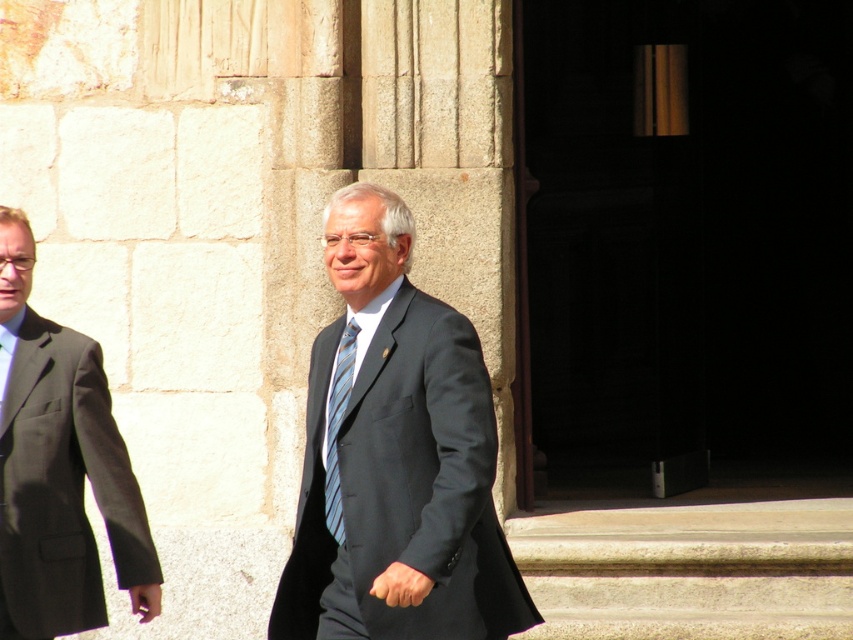
Question: Is the position of matte black suit at center less distant than that of matte black suit at left?

Choices:
 (A) no
 (B) yes

Answer: (B)

Question: Is matte black suit at left positioned behind striped fabric tie at center?

Choices:
 (A) yes
 (B) no

Answer: (A)

Question: Among these objects, which one is farthest from the camera?

Choices:
 (A) matte black suit at center
 (B) matte black suit at left
 (C) striped fabric tie at center

Answer: (B)

Question: Which of the following is the closest to the observer?

Choices:
 (A) striped fabric tie at center
 (B) matte black suit at center

Answer: (B)

Question: Which of the following is the closest to the observer?

Choices:
 (A) matte black suit at left
 (B) matte black suit at center
 (C) striped fabric tie at center

Answer: (B)

Question: Does matte black suit at center have a smaller size compared to striped fabric tie at center?

Choices:
 (A) no
 (B) yes

Answer: (A)